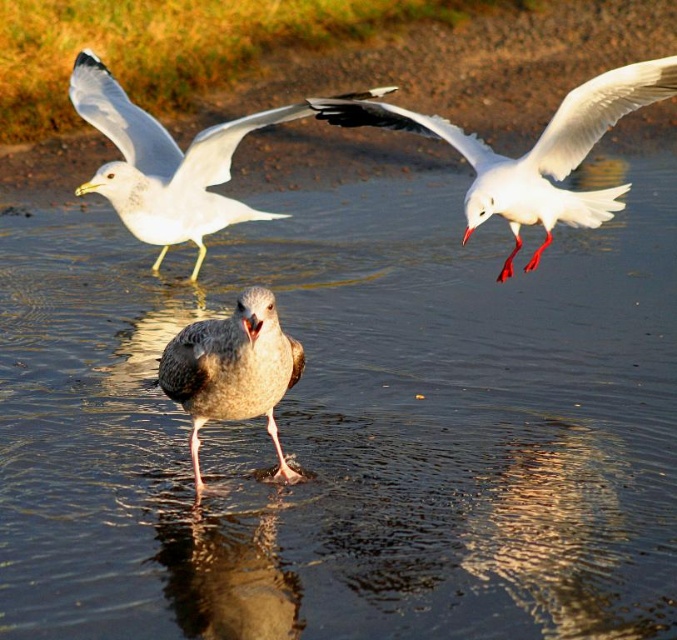
Question: Among these objects, which one is nearest to the camera?

Choices:
 (A) white matte seagull at upper left
 (B) white glossy seagull at upper right
 (C) gray feathered bird at center

Answer: (C)

Question: Which point is farther from the camera taking this photo?

Choices:
 (A) (269, 364)
 (B) (471, 152)

Answer: (B)

Question: Does white matte seagull at upper left lie behind gray feathered bird at center?

Choices:
 (A) no
 (B) yes

Answer: (B)

Question: Which object appears closest to the camera in this image?

Choices:
 (A) gray feathered bird at center
 (B) white glossy seagull at upper right

Answer: (A)

Question: Considering the relative positions of white glossy seagull at upper right and gray feathered bird at center in the image provided, where is white glossy seagull at upper right located with respect to gray feathered bird at center?

Choices:
 (A) above
 (B) below

Answer: (A)

Question: Is white glossy seagull at upper right bigger than gray feathered bird at center?

Choices:
 (A) yes
 (B) no

Answer: (A)